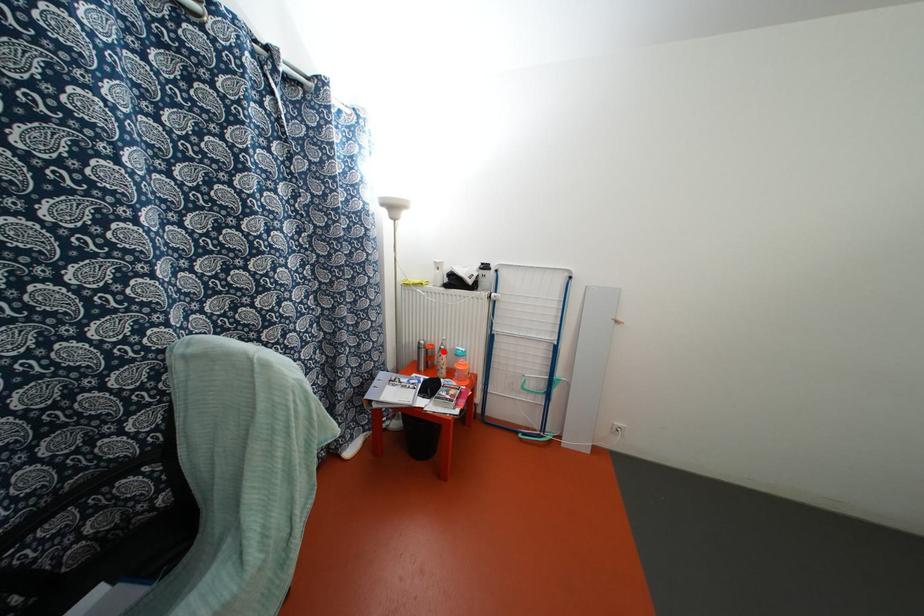
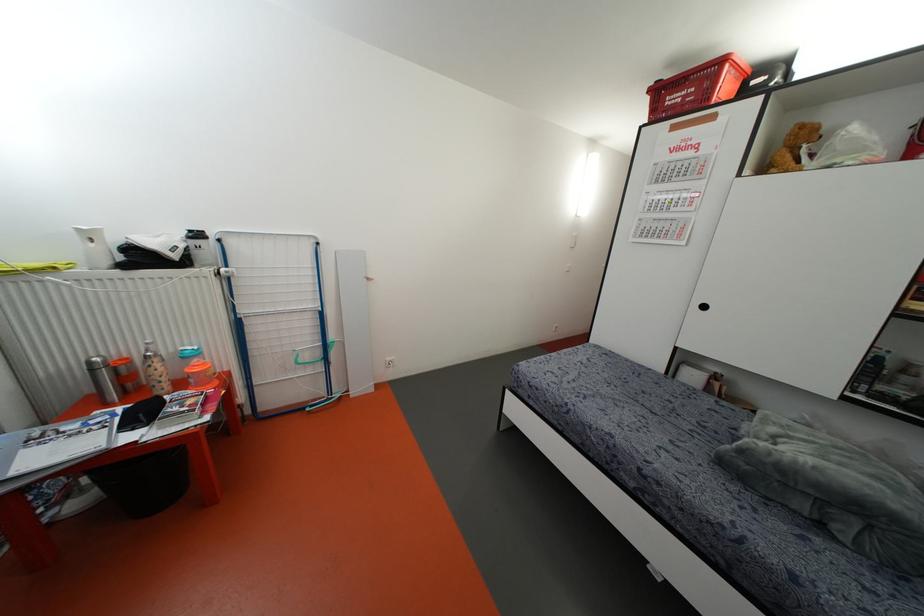
Question: A red point is marked in image1. In image2, is the corresponding 3D point closer to the camera or farther? Reply with the corresponding letter.

Choices:
 (A) The corresponding 3D point is closer.
 (B) The corresponding 3D point is farther.

Answer: (A)